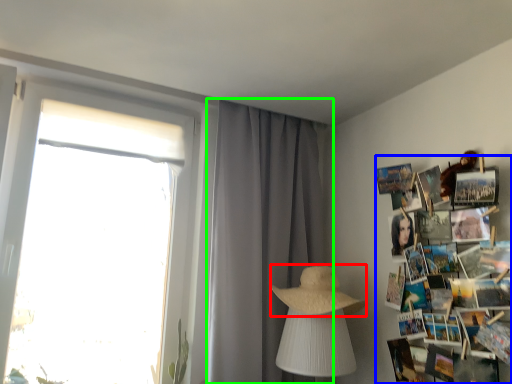
Question: Considering the real-world distances, which object is farthest from straw hat (highlighted by a red box)? magazine (highlighted by a blue box) or curtain (highlighted by a green box)?

Choices:
 (A) magazine
 (B) curtain

Answer: (A)